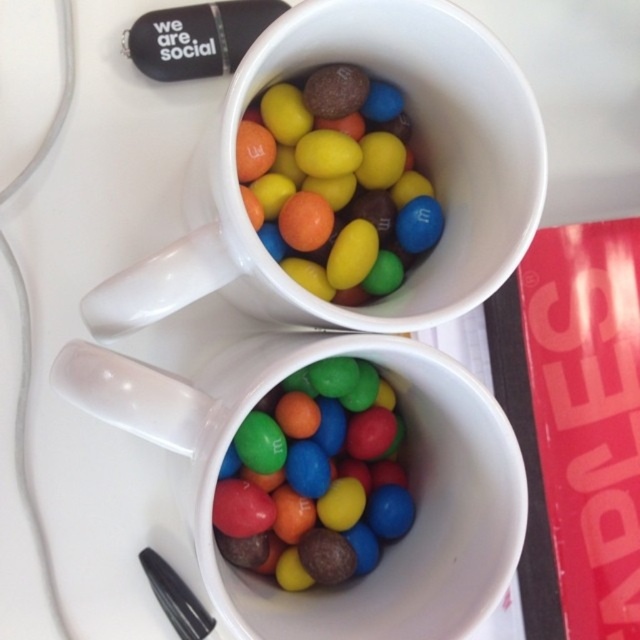
Question: Which object appears farthest from the camera in this image?

Choices:
 (A) glossy chocolate candy at center
 (B) white ceramic mug at upper center

Answer: (A)

Question: Among these points, which one is nearest to the camera?

Choices:
 (A) (237, 508)
 (B) (252, 218)

Answer: (A)

Question: Does white ceramic mug at upper center have a greater width compared to glossy chocolate candy at center?

Choices:
 (A) yes
 (B) no

Answer: (A)

Question: Is glossy chocolate candy at center to the right of glossy plastic m&m's at center from the viewer's perspective?

Choices:
 (A) yes
 (B) no

Answer: (A)

Question: Estimate the real-world distances between objects in this image. Which object is farther from the glossy ceramic mug at upper center?

Choices:
 (A) glossy plastic m&m's at center
 (B) glossy chocolate candy at center
 (C) white ceramic mug at upper center

Answer: (B)

Question: Does glossy ceramic mug at upper center have a smaller size compared to glossy plastic m&m's at center?

Choices:
 (A) no
 (B) yes

Answer: (A)